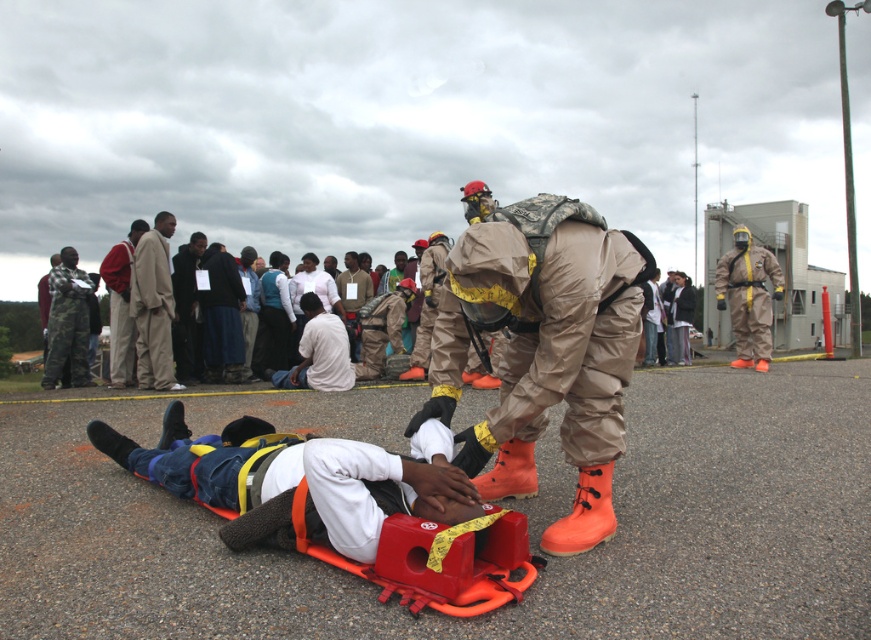
You are a photographer trying to capture a clear photo of both the camouflage fabric hazmat suit at center and the denim pants at center. Since you want to ensure both are visible in the frame, which object should you position closer to the camera to avoid obstruction?

The camouflage fabric hazmat suit at center is to the right of denim pants at center. To avoid obstruction, position the camouflage fabric hazmat suit at center closer to the camera so both can be seen clearly.

You are a first responder at the scene and need to quickly identify the hazmat suits. Which of the following is located to the left of the other? The camouflage fabric hazmat suit at center and the matte khaki hazmat suit at right.

The camouflage fabric hazmat suit at center is positioned on the left side of matte khaki hazmat suit at right.

Looking at this image, you are a first responder assessing the scene. You see a camouflage fabric hazmat suit at center and a denim pants at center. Which item is smaller in size?

The camouflage fabric hazmat suit at center is smaller in size compared to the denim pants at center.